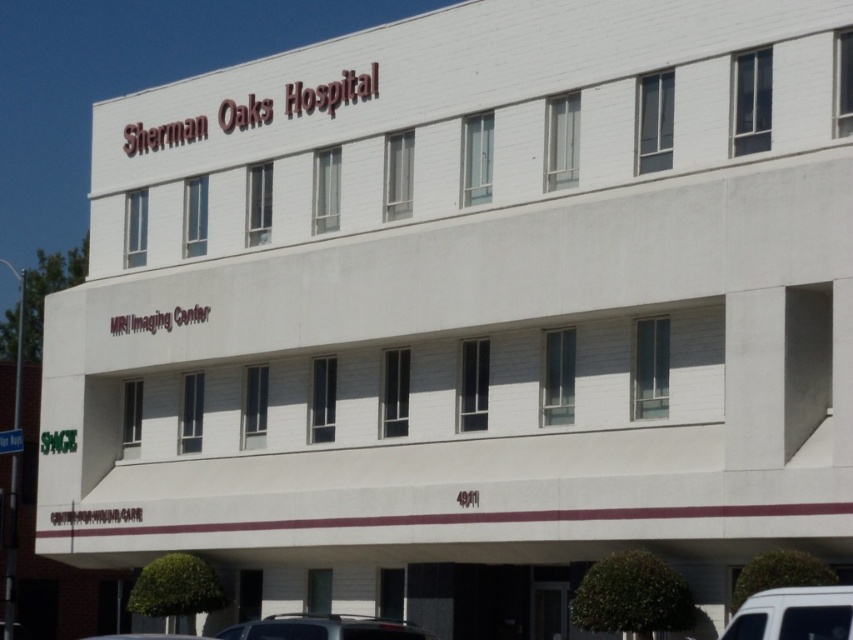
Question: Is white matte van at lower right closer to the viewer compared to white matte car at lower center?

Choices:
 (A) yes
 (B) no

Answer: (A)

Question: Which is nearer to the black matte car at lower center?

Choices:
 (A) white matte van at lower right
 (B) white matte car at lower center

Answer: (B)

Question: Which is farther from the white matte van at lower right?

Choices:
 (A) black matte car at lower center
 (B) white matte car at lower center

Answer: (B)

Question: Can you confirm if white matte van at lower right is wider than white matte car at lower center?

Choices:
 (A) yes
 (B) no

Answer: (B)

Question: Is white matte van at lower right to the right of white matte car at lower center from the viewer's perspective?

Choices:
 (A) yes
 (B) no

Answer: (A)

Question: Which point is closer to the camera taking this photo?

Choices:
 (A) (183, 637)
 (B) (323, 630)

Answer: (B)